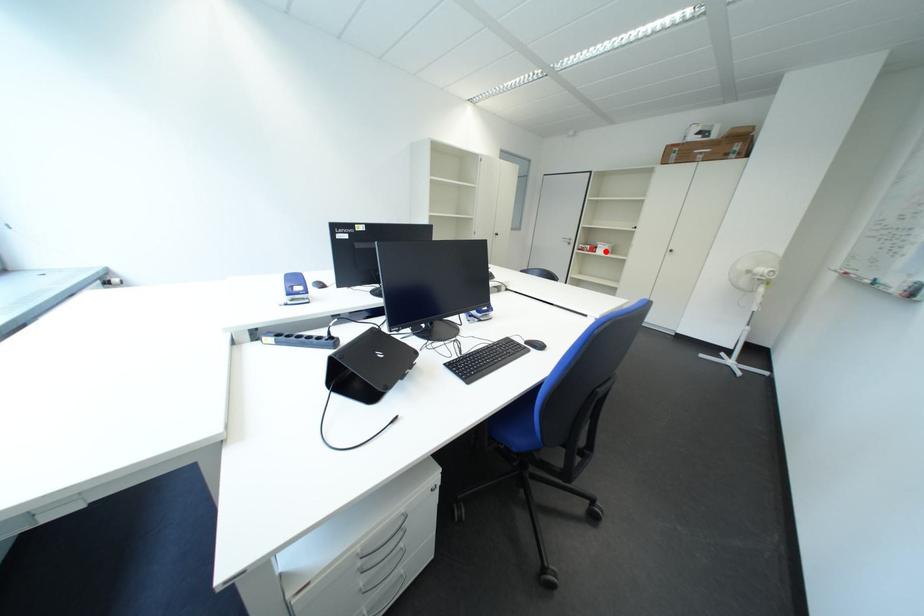
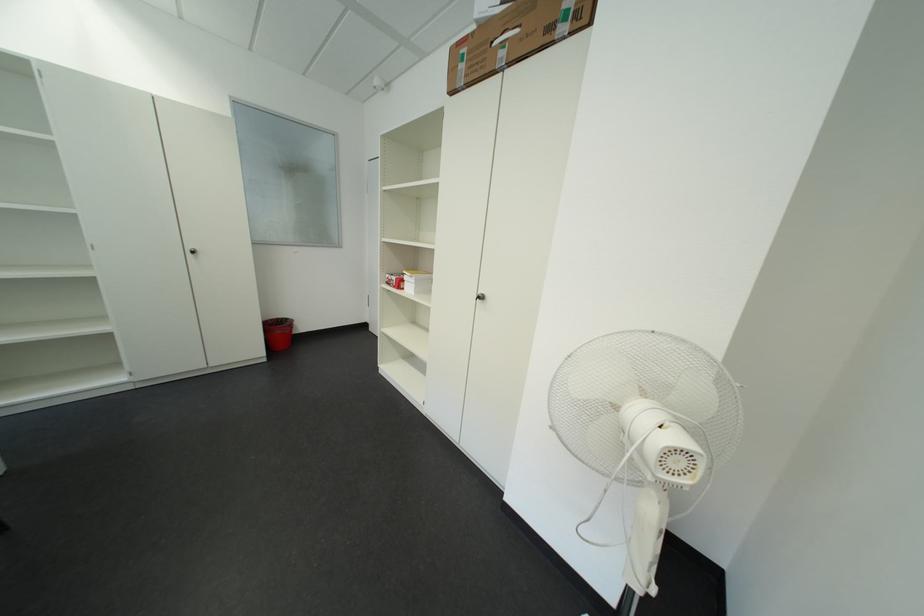
Question: I am providing you with two images of the same scene from different viewpoints. Given a red point in image1, look at the same physical point in image2. Is it:

Choices:
 (A) Closer to the viewpoint
 (B) Farther from the viewpoint

Answer: (B)